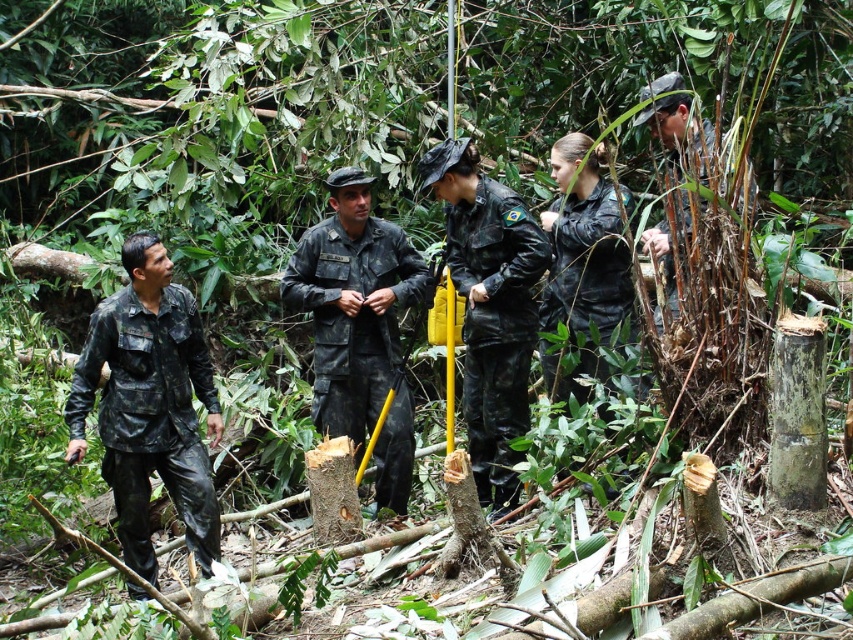
Question: Estimate the real-world distances between objects in this image. Which object is farther from the black matte jacket at center?

Choices:
 (A) black matte uniform at center
 (B) camouflage fabric uniform at center
 (C) camouflage fabric uniform at left

Answer: (C)

Question: Can you confirm if camouflage fabric uniform at center is thinner than black matte uniform at center?

Choices:
 (A) no
 (B) yes

Answer: (A)

Question: Which point is farther to the camera?

Choices:
 (A) black matte jacket at center
 (B) camouflage fabric uniform at left
 (C) black matte uniform at center

Answer: (C)

Question: Among these points, which one is nearest to the camera?

Choices:
 (A) (112, 316)
 (B) (589, 372)

Answer: (A)

Question: Considering the relative positions of camouflage fabric uniform at center and black matte uniform at center in the image provided, where is camouflage fabric uniform at center located with respect to black matte uniform at center?

Choices:
 (A) right
 (B) left

Answer: (B)

Question: Considering the relative positions of camouflage fabric uniform at left and camouflage fabric uniform at center in the image provided, where is camouflage fabric uniform at left located with respect to camouflage fabric uniform at center?

Choices:
 (A) above
 (B) below

Answer: (B)